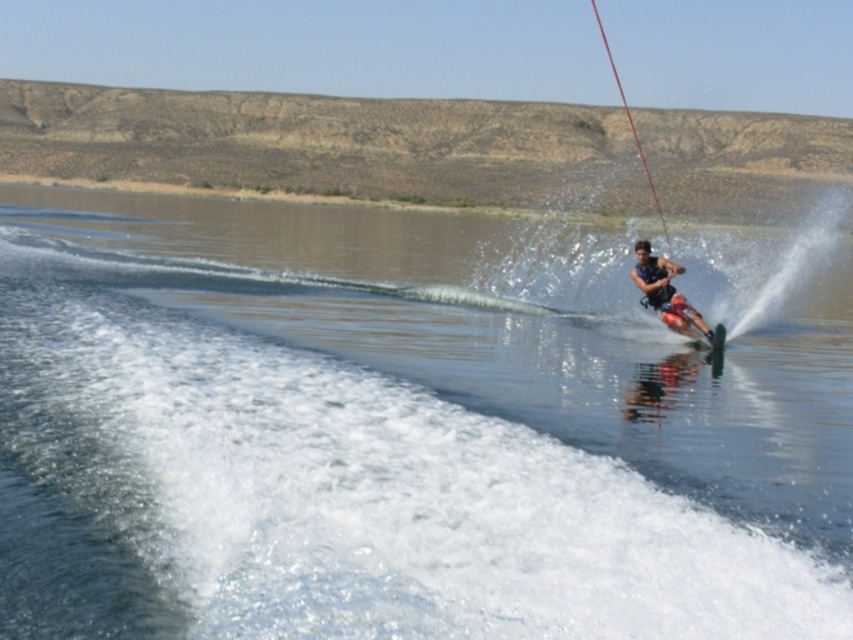
You are a photographer trying to capture the water skier. You notice the clear water at center and the matte black life vest at center. Which object is positioned to the left side of the other?

The clear water at center is positioned to the left of the matte black life vest at center.